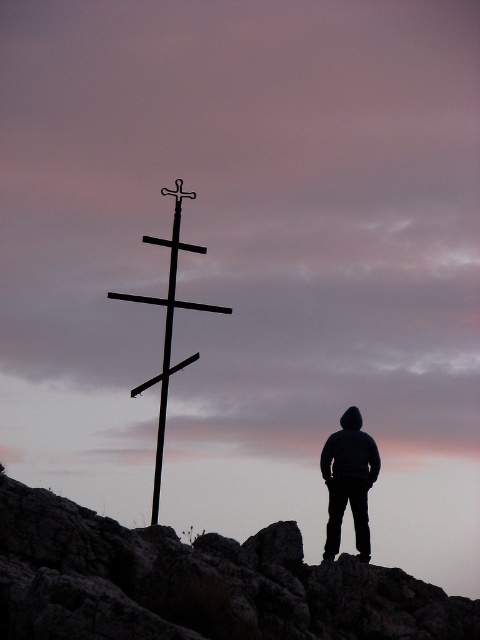
Between rugged stone rock at center and black metal cross at center, which one is positioned lower?

rugged stone rock at center is below.

Does rugged stone rock at center have a larger size compared to black metal cross at center?

No.

Where is `rugged stone rock at center`? This screenshot has width=480, height=640. rugged stone rock at center is located at coordinates (196, 582).

From the picture: Who is lower down, black matte hoodie at lower right or black metal cross at center?

Positioned lower is black matte hoodie at lower right.

Can you confirm if black matte hoodie at lower right is bigger than black metal cross at center?

Incorrect, black matte hoodie at lower right is not larger than black metal cross at center.

Image resolution: width=480 pixels, height=640 pixels. I want to click on black matte hoodie at lower right, so click(348, 481).

The image size is (480, 640). I want to click on black matte hoodie at lower right, so click(348, 481).

Who is higher up, rugged stone rock at center or black matte hoodie at lower right?

black matte hoodie at lower right

Find the location of a particular element. The height and width of the screenshot is (640, 480). rugged stone rock at center is located at coordinates click(x=196, y=582).